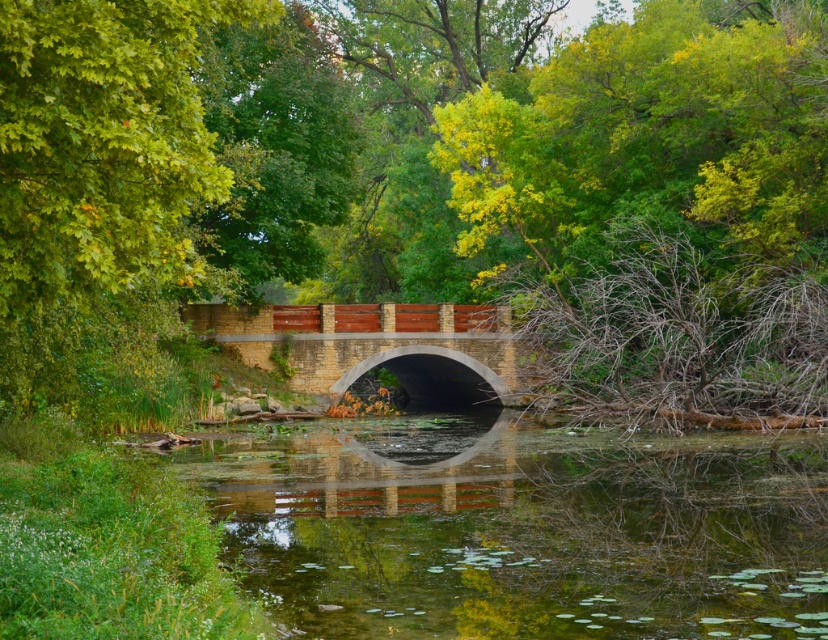
Question: Which point is farther to the camera?

Choices:
 (A) brick stone bridge at center
 (B) green reflective water at center

Answer: (A)

Question: In this image, where is green reflective water at center located relative to brick stone bridge at center?

Choices:
 (A) left
 (B) right

Answer: (B)

Question: Which object appears closest to the camera in this image?

Choices:
 (A) green leafy tree at left
 (B) green reflective water at center

Answer: (A)

Question: Does green reflective water at center appear over brick stone bridge at center?

Choices:
 (A) no
 (B) yes

Answer: (A)

Question: Which object is the farthest from the green leafy tree at left?

Choices:
 (A) brick stone bridge at center
 (B) green reflective water at center

Answer: (A)

Question: Does green reflective water at center lie behind green leafy tree at left?

Choices:
 (A) yes
 (B) no

Answer: (A)